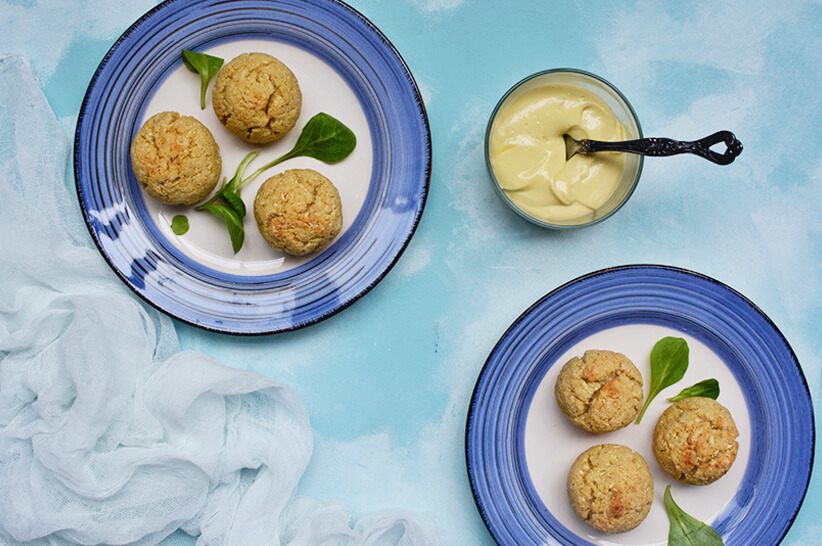
The height and width of the screenshot is (546, 822). In order to click on spoon in this screenshot , I will do `click(663, 141)`.